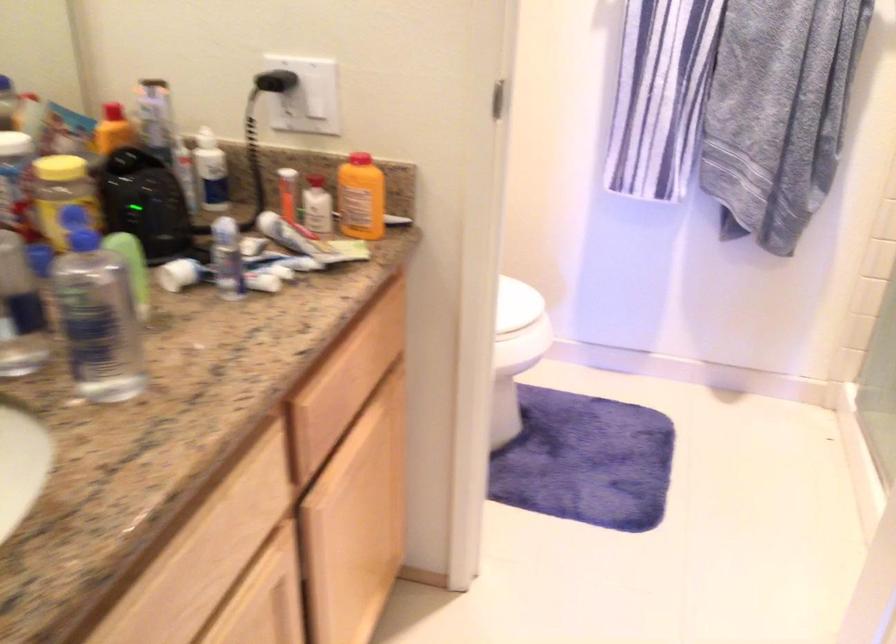
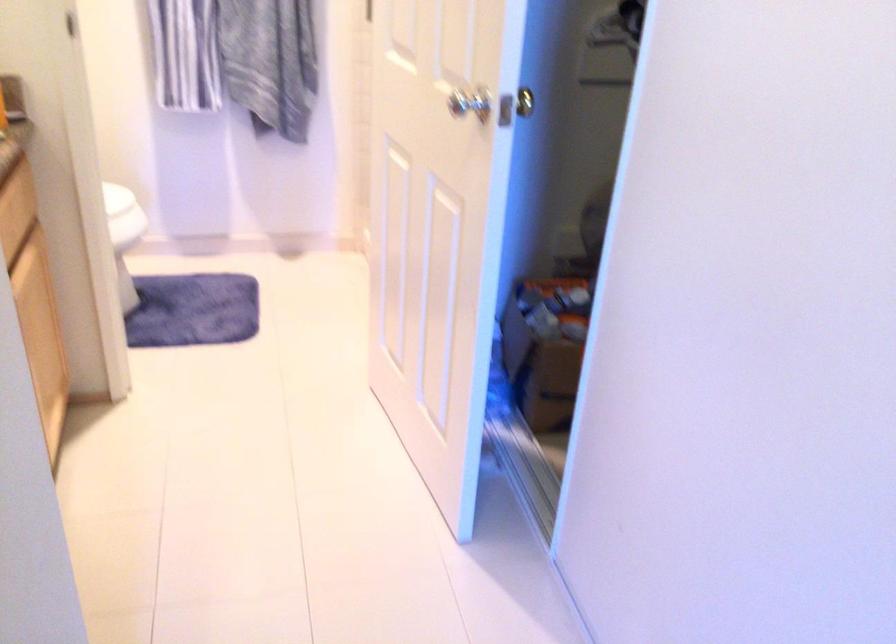
Question: How did the camera likely rotate?

Choices:
 (A) Left
 (B) Right
 (C) Up
 (D) Down

Answer: (B)